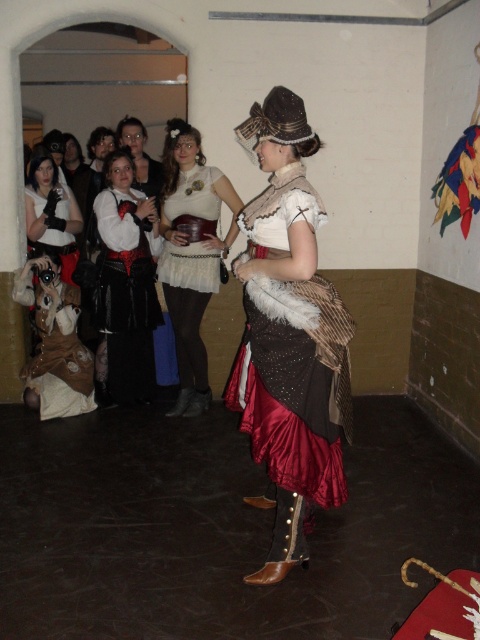
Question: Is matte white dress at center bigger than brown leather vest at lower left?

Choices:
 (A) no
 (B) yes

Answer: (B)

Question: Which object appears closest to the camera in this image?

Choices:
 (A) matte white dress at center
 (B) satin brown dress at center
 (C) brown leather vest at lower left

Answer: (B)

Question: Does matte white dress at center appear on the right side of brown leather vest at lower left?

Choices:
 (A) no
 (B) yes

Answer: (B)

Question: Which object is the closest to the satin brown dress at center?

Choices:
 (A) brown leather vest at lower left
 (B) matte black gloves at left
 (C) matte black dress at center

Answer: (C)

Question: Is satin brown dress at center further to the viewer compared to brown leather vest at lower left?

Choices:
 (A) yes
 (B) no

Answer: (B)

Question: Which point is closer to the camera taking this photo?

Choices:
 (A) (200, 337)
 (B) (142, 241)
 (C) (78, 349)
 (D) (276, 550)

Answer: (D)